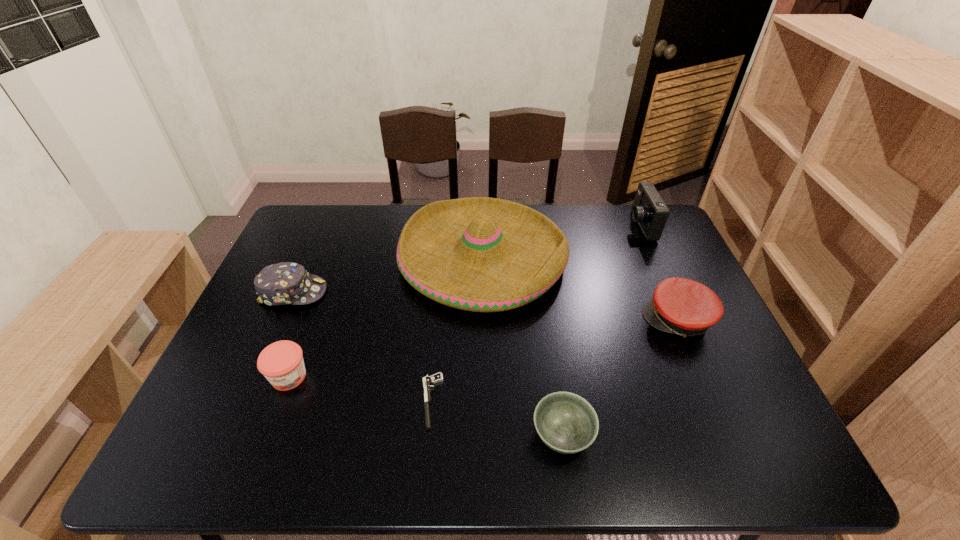
You are a GUI agent. You are given a task and a screenshot of the screen. Output one action in this format:
    pyautogui.click(x=<x>, y=<y>)
    Task: Click on the tallest object
    The height and width of the screenshot is (540, 960).
    Given the screenshot: What is the action you would take?
    pyautogui.click(x=480, y=254)

The height and width of the screenshot is (540, 960). What are the coordinates of `camera` in the screenshot? It's located at (649, 210).

This screenshot has width=960, height=540. Find the location of `the left cap`. the left cap is located at coordinates (285, 283).

Locate an element on the screen. The height and width of the screenshot is (540, 960). the right cap is located at coordinates (680, 306).

Image resolution: width=960 pixels, height=540 pixels. Find the location of `jam`. jam is located at coordinates (282, 364).

What are the coordinates of `the second shortest object` in the screenshot? It's located at (567, 423).

The height and width of the screenshot is (540, 960). Find the location of `the shortest object`. the shortest object is located at coordinates (438, 377).

This screenshot has width=960, height=540. What are the coordinates of `vacant space located on the right of the sombrero` in the screenshot? It's located at (658, 258).

Find the location of a particular element. This screenshot has height=540, width=960. vacant region located on the front-facing side of the second tallest object is located at coordinates (530, 226).

I want to click on free point located 0.330m on the front-facing side of the second tallest object, so click(533, 226).